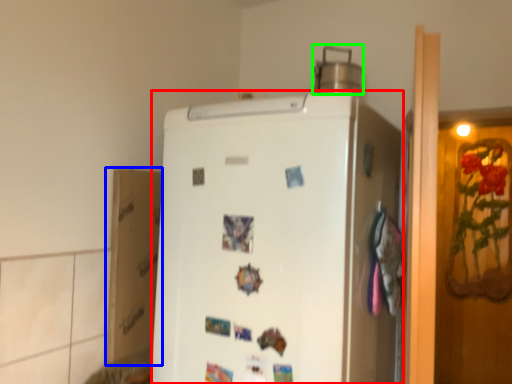
Question: Which object is the closest to the refrigerator (highlighted by a red box)? Choose among these: cardboard box (highlighted by a blue box) or appliance (highlighted by a green box).

Choices:
 (A) cardboard box
 (B) appliance

Answer: (A)